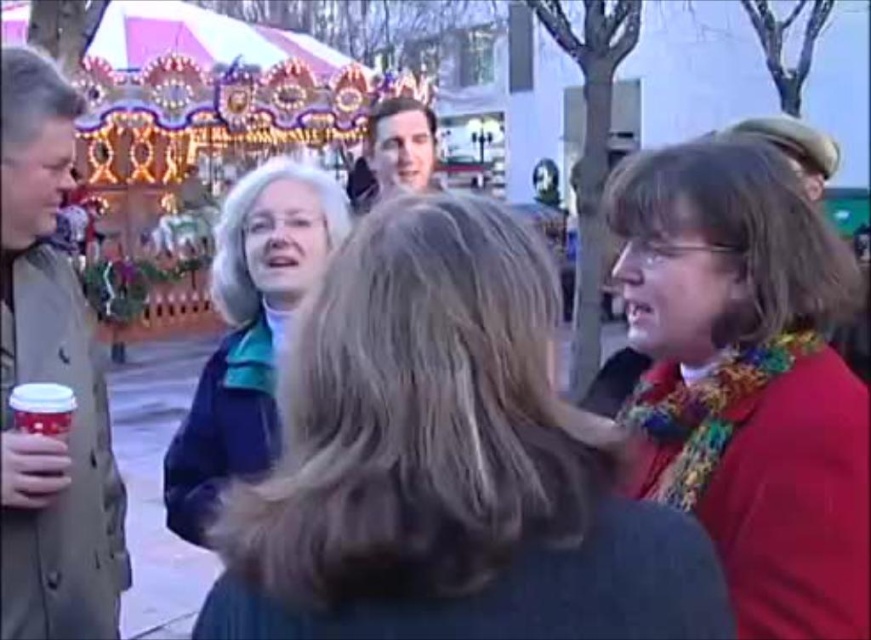
Does point (333, 237) come closer to viewer compared to point (68, 403)?

No, (333, 237) is behind (68, 403).

Which of these two, blue fabric jacket at center or matte red cup at lower left, stands shorter?

matte red cup at lower left

You are a GUI agent. You are given a task and a screenshot of the screen. Output one action in this format:
    pyautogui.click(x=<x>, y=<y>)
    Task: Click on the blue fabric jacket at center
    This screenshot has width=871, height=640.
    Given the screenshot: What is the action you would take?
    pyautogui.click(x=248, y=332)

Can you confirm if blue fabric jacket at center is positioned to the right of smooth skin face at center?

Correct, you'll find blue fabric jacket at center to the right of smooth skin face at center.

Can you confirm if blue fabric jacket at center is thinner than smooth skin face at center?

Yes.

The image size is (871, 640). What do you see at coordinates (248, 332) in the screenshot? I see `blue fabric jacket at center` at bounding box center [248, 332].

Where is `blue fabric jacket at center`? This screenshot has width=871, height=640. blue fabric jacket at center is located at coordinates (248, 332).

Which is more to the right, red matte scarf at right or matte red cup at lower left?

red matte scarf at right

Can you confirm if red matte scarf at right is positioned to the left of matte red cup at lower left?

No, red matte scarf at right is not to the left of matte red cup at lower left.

Identify the location of red matte scarf at right. (747, 378).